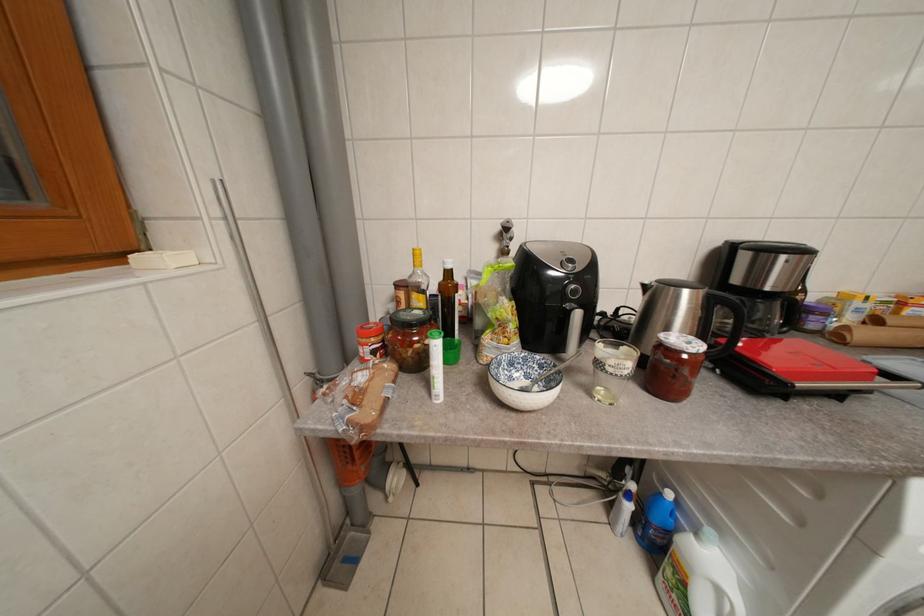
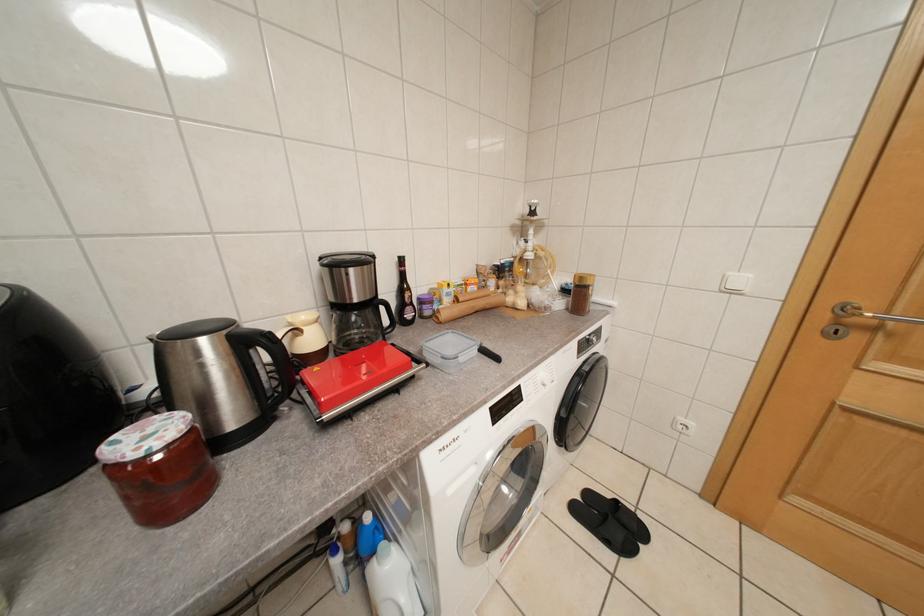
Question: The camera is either moving clockwise (left) or counter-clockwise (right) around the object. The first image is from the beginning of the video and the second image is from the end. Is the camera moving left or right when shooting the video?

Choices:
 (A) Left
 (B) Right

Answer: (A)